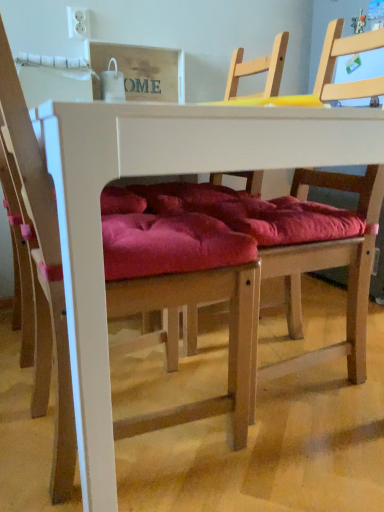
Question: Can you confirm if velvet red cushion at center, placed as the 2th chair when sorted from right to left, is wider than white matte table at center?

Choices:
 (A) no
 (B) yes

Answer: (A)

Question: Does velvet red cushion at center, the first chair positioned from the left, have a smaller size compared to white matte table at center?

Choices:
 (A) yes
 (B) no

Answer: (A)

Question: Is white matte table at center at the back of velvet red cushion at center, placed as the 2th chair when sorted from right to left?

Choices:
 (A) no
 (B) yes

Answer: (B)

Question: From the image's perspective, is velvet red cushion at center, the first chair positioned from the left, under white matte table at center?

Choices:
 (A) no
 (B) yes

Answer: (A)

Question: Considering the relative positions of velvet red cushion at center, the first chair positioned from the left, and white matte table at center in the image provided, is velvet red cushion at center, the first chair positioned from the left, to the right of white matte table at center from the viewer's perspective?

Choices:
 (A) no
 (B) yes

Answer: (A)

Question: Does velvet red cushion at center, the first chair positioned from the left, have a larger size compared to white matte table at center?

Choices:
 (A) no
 (B) yes

Answer: (A)

Question: From the image's perspective, is white matte table at center above velvet red cushion at center, the first chair positioned from the left?

Choices:
 (A) no
 (B) yes

Answer: (A)

Question: Does white matte table at center have a smaller size compared to velvet red cushion at center, placed as the 2th chair when sorted from right to left?

Choices:
 (A) yes
 (B) no

Answer: (B)

Question: Is velvet red cushion at center, the first chair positioned from the left, at the back of white matte table at center?

Choices:
 (A) yes
 (B) no

Answer: (A)

Question: From a real-world perspective, is white matte table at center physically above velvet red cushion at center, the first chair positioned from the left?

Choices:
 (A) yes
 (B) no

Answer: (B)

Question: Considering the relative sizes of white matte table at center and velvet red cushion at center, the first chair positioned from the left, in the image provided, is white matte table at center bigger than velvet red cushion at center, the first chair positioned from the left,?

Choices:
 (A) yes
 (B) no

Answer: (A)

Question: Is velvet red cushion at center, the first chair positioned from the left, a part of white matte table at center?

Choices:
 (A) no
 (B) yes

Answer: (B)

Question: Is wooden chair at center, the 2th chair from the left, positioned before white matte table at center?

Choices:
 (A) yes
 (B) no

Answer: (B)